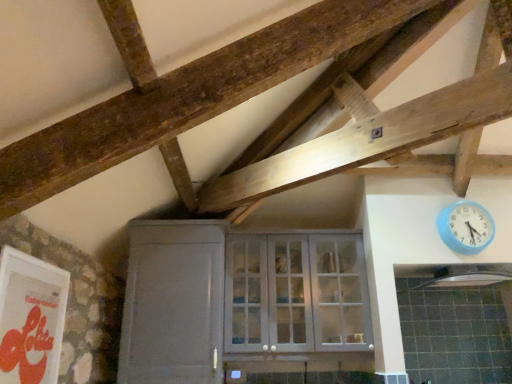
Describe the element at coordinates (466, 227) in the screenshot. I see `blue plastic wall clock at upper right` at that location.

Describe the element at coordinates (462, 275) in the screenshot. I see `black matte exhaust hood at upper right` at that location.

Measure the distance between point (135, 284) and camera.

The distance of point (135, 284) from camera is 2.70 meters.

Locate an element on the screen. The height and width of the screenshot is (384, 512). blue plastic wall clock at upper right is located at coordinates (466, 227).

You are a GUI agent. You are given a task and a screenshot of the screen. Output one action in this format:
    pyautogui.click(x=<x>, y=<y>)
    Task: Click on the wall clock that appears above the white glass cabinet at center (from a real-world perspective)
    
    Given the screenshot: What is the action you would take?
    pyautogui.click(x=466, y=227)

Which is behind, point (318, 286) or point (468, 246)?

The point (318, 286) is farther from the camera.

Is white glass cabinet at center with blue plastic wall clock at upper right?

No.

Looking at this image, which of these two, white glass cabinet at center or black matte exhaust hood at upper right, is wider?

With larger width is black matte exhaust hood at upper right.

Considering the relative positions of white glass cabinet at center and black matte exhaust hood at upper right in the image provided, is white glass cabinet at center in front of black matte exhaust hood at upper right?

No, white glass cabinet at center is further to the viewer.

Is white glass cabinet at center to the left or to the right of black matte exhaust hood at upper right in the image?

white glass cabinet at center is positioned on black matte exhaust hood at upper right's left side.

Does point (465, 252) come closer to viewer compared to point (308, 302)?

Yes, it is in front of point (308, 302).

Is blue plastic wall clock at upper right taller or shorter than white glass cabinet at center?

In the image, blue plastic wall clock at upper right appears to be shorter than white glass cabinet at center.

Is blue plastic wall clock at upper right not close to white glass cabinet at center?

No, blue plastic wall clock at upper right is not far away from white glass cabinet at center.

Which is in front, point (441, 269) or point (161, 224)?

Point (161, 224)

At what (x,y) coordinates should I click in order to perform the action: click on exhaust hood lying above the white matte door at lower left (from the image's perspective). Please return your answer as a coordinate pair (x, y). Image resolution: width=512 pixels, height=384 pixels. Looking at the image, I should click on [462, 275].

Can you confirm if black matte exhaust hood at upper right is shorter than white matte door at lower left?

Correct, black matte exhaust hood at upper right is not as tall as white matte door at lower left.

Measure the distance from blue plastic wall clock at upper right to black matte exhaust hood at upper right.

blue plastic wall clock at upper right is 9.40 inches from black matte exhaust hood at upper right.

Where is `exhaust hood below the blue plastic wall clock at upper right (from a real-world perspective)`? The width and height of the screenshot is (512, 384). exhaust hood below the blue plastic wall clock at upper right (from a real-world perspective) is located at coordinates (462, 275).

Is blue plastic wall clock at upper right turned away from black matte exhaust hood at upper right?

That's not correct — blue plastic wall clock at upper right is not looking away from black matte exhaust hood at upper right.

How different are the orientations of blue plastic wall clock at upper right and black matte exhaust hood at upper right in degrees?

1.42 degrees.

From a real-world perspective, is blue plastic wall clock at upper right above or below white matte door at lower left?

In terms of real-world spatial position, blue plastic wall clock at upper right is above white matte door at lower left.

Is blue plastic wall clock at upper right taller than white matte door at lower left?

No, blue plastic wall clock at upper right is not taller than white matte door at lower left.

Which object is closer to the camera taking this photo, blue plastic wall clock at upper right or white matte door at lower left?

white matte door at lower left is more forward.

From the image's perspective, would you say blue plastic wall clock at upper right is shown under white matte door at lower left?

No, from the image's perspective, blue plastic wall clock at upper right is not below white matte door at lower left.

Based on the photo, which is farther from the camera, (248, 345) or (157, 316)?

The point (248, 345) is more distant.

From a real-world perspective, is white glass cabinet at center positioned above or below white matte door at lower left?

Clearly, from a real-world perspective, white glass cabinet at center is above white matte door at lower left.

Is white glass cabinet at center positioned in front of white matte door at lower left?

No, it is behind white matte door at lower left.

From the image's perspective, is white glass cabinet at center located above white matte door at lower left?

Yes, from the image's perspective, white glass cabinet at center is on top of white matte door at lower left.

This screenshot has height=384, width=512. I want to click on window that is below the blue plastic wall clock at upper right (from the image's perspective), so click(296, 293).

Where is `window directly beneath the black matte exhaust hood at upper right (from a real-world perspective)`? The height and width of the screenshot is (384, 512). window directly beneath the black matte exhaust hood at upper right (from a real-world perspective) is located at coordinates (296, 293).

When comparing their distances from white matte door at lower left, does white glass cabinet at center or black matte exhaust hood at upper right seem closer?

white glass cabinet at center is positioned closer to the anchor white matte door at lower left.

From the image, which object appears to be nearer to white glass cabinet at center, blue plastic wall clock at upper right or white matte door at lower left?

Among the two, white matte door at lower left is located nearer to white glass cabinet at center.

Considering their positions, is black matte exhaust hood at upper right positioned further to blue plastic wall clock at upper right than white matte door at lower left?

white matte door at lower left.

Looking at the image, which one is located closer to blue plastic wall clock at upper right, white glass cabinet at center or black matte exhaust hood at upper right?

The object closer to blue plastic wall clock at upper right is black matte exhaust hood at upper right.

Based on their spatial positions, is white glass cabinet at center or white matte door at lower left closer to black matte exhaust hood at upper right?

white glass cabinet at center is positioned closer to the anchor black matte exhaust hood at upper right.

From the image, which object appears to be nearer to white glass cabinet at center, white matte door at lower left or blue plastic wall clock at upper right?

white matte door at lower left is closer to white glass cabinet at center.

In the scene shown: Considering their positions, is blue plastic wall clock at upper right positioned further to black matte exhaust hood at upper right than white glass cabinet at center?

Among the two, white glass cabinet at center is located further to black matte exhaust hood at upper right.

Looking at the image, which one is located closer to blue plastic wall clock at upper right, white matte door at lower left or white glass cabinet at center?

white glass cabinet at center is positioned closer to the anchor blue plastic wall clock at upper right.

Image resolution: width=512 pixels, height=384 pixels. In order to click on window between white matte door at lower left and black matte exhaust hood at upper right in this screenshot , I will do `click(296, 293)`.

At what (x,y) coordinates should I click in order to perform the action: click on window located between white matte door at lower left and blue plastic wall clock at upper right in the left-right direction. Please return your answer as a coordinate pair (x, y). Looking at the image, I should click on (296, 293).

Image resolution: width=512 pixels, height=384 pixels. I want to click on wall clock between white glass cabinet at center and black matte exhaust hood at upper right, so click(x=466, y=227).

Locate an element on the screen. wall clock between white matte door at lower left and black matte exhaust hood at upper right in the horizontal direction is located at coordinates (466, 227).